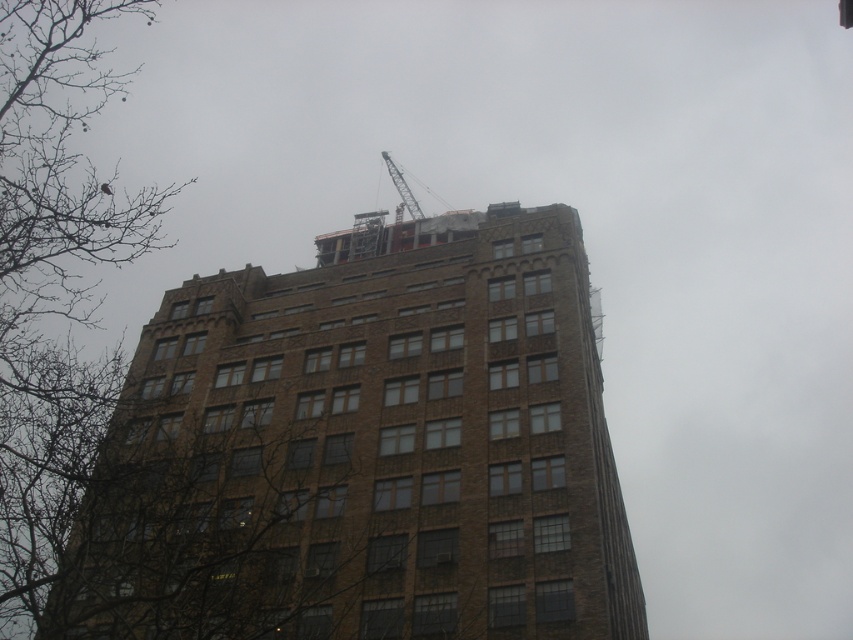
Does brown brick building at center have a lesser width compared to metallic gray crane at top?

Incorrect, brown brick building at center's width is not less than metallic gray crane at top's.

Is point (563, 332) farther from camera compared to point (396, 173)?

No, it is not.

Where is `brown brick building at center`? This screenshot has width=853, height=640. brown brick building at center is located at coordinates (364, 449).

This screenshot has height=640, width=853. Find the location of `brown brick building at center`. brown brick building at center is located at coordinates (364, 449).